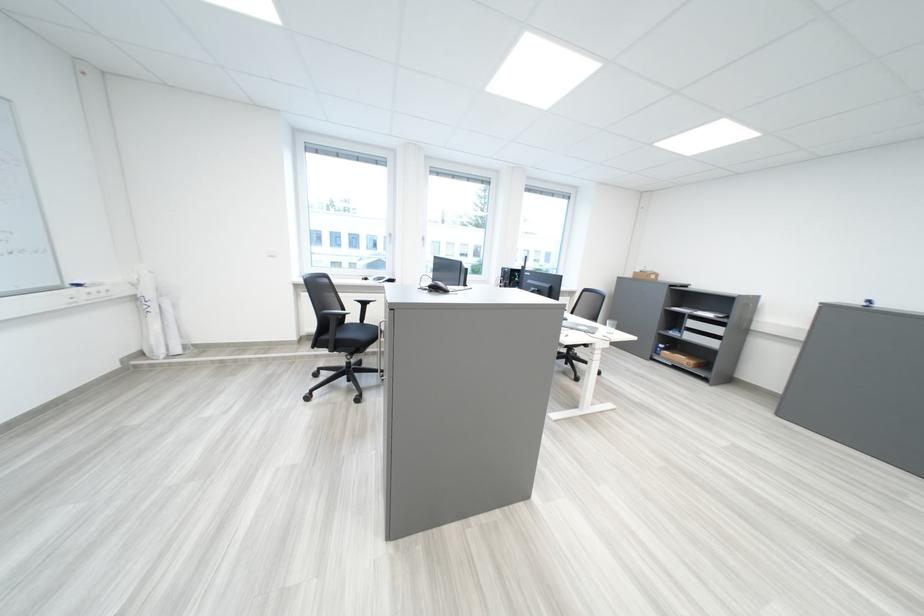
Describe the element at coordinates (355, 334) in the screenshot. I see `the black chair sitting surface` at that location.